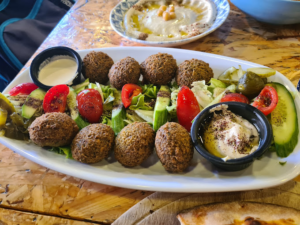
At what (x,y) coordinates should I click in order to perform the action: click on table. Please return your answer as a coordinate pair (x, y). Looking at the image, I should click on (86, 13).